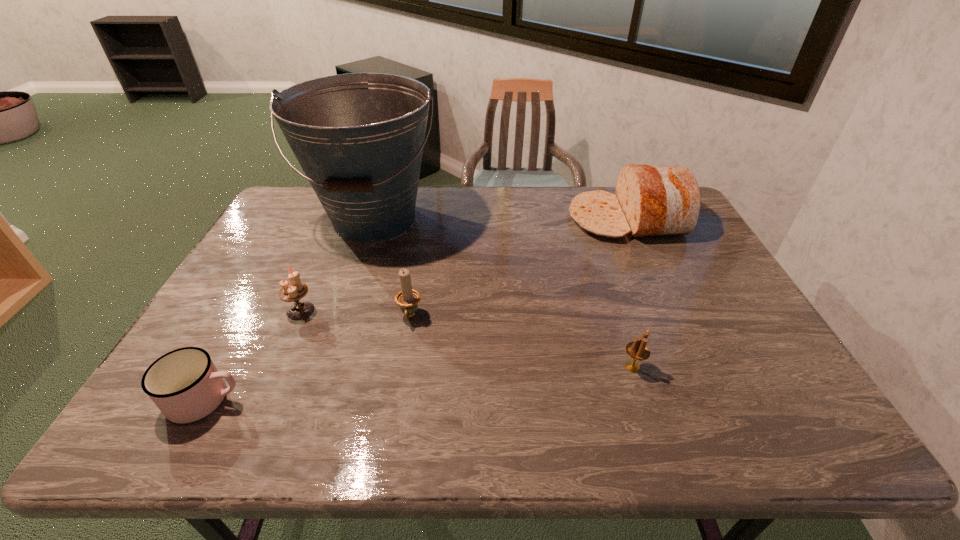
You are a GUI agent. You are given a task and a screenshot of the screen. Output one action in this format:
    pyautogui.click(x=<x>, y=<y>)
    Task: Click on the vacant position in the image that satisfies the following two spatial constraints: 1. on the handle side of the second candle holder from right to left; 2. on the side of the shortest object with the handle
    
    Given the screenshot: What is the action you would take?
    click(396, 400)

Where is `vacant region that satisfies the following two spatial constraints: 1. at the sliced end of the bread; 2. on the handle side of the second candle holder from left to right`? The width and height of the screenshot is (960, 540). vacant region that satisfies the following two spatial constraints: 1. at the sliced end of the bread; 2. on the handle side of the second candle holder from left to right is located at coordinates (671, 316).

The image size is (960, 540). I want to click on blank area in the image that satisfies the following two spatial constraints: 1. on the handle side of the rightmost candle holder; 2. on the right side of the second candle holder from left to right, so click(401, 367).

Identify the location of vacant space that satisfies the following two spatial constraints: 1. at the sliced end of the second tallest object; 2. on the handle side of the second candle holder from right to left. This screenshot has width=960, height=540. (671, 316).

Where is `free space that satisfies the following two spatial constraints: 1. on the handle side of the rightmost candle holder; 2. on the left side of the second candle holder from left to right`? free space that satisfies the following two spatial constraints: 1. on the handle side of the rightmost candle holder; 2. on the left side of the second candle holder from left to right is located at coordinates (401, 367).